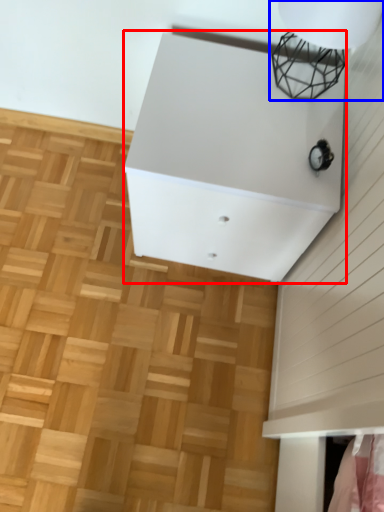
Question: Which object is closer to the camera taking this photo, furniture (highlighted by a red box) or lamp (highlighted by a blue box)?

Choices:
 (A) furniture
 (B) lamp

Answer: (B)